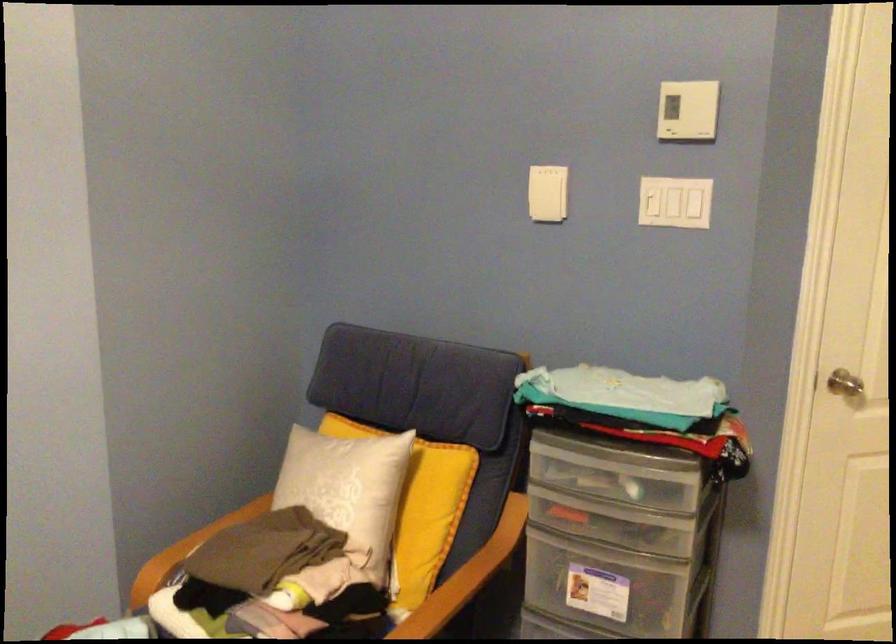
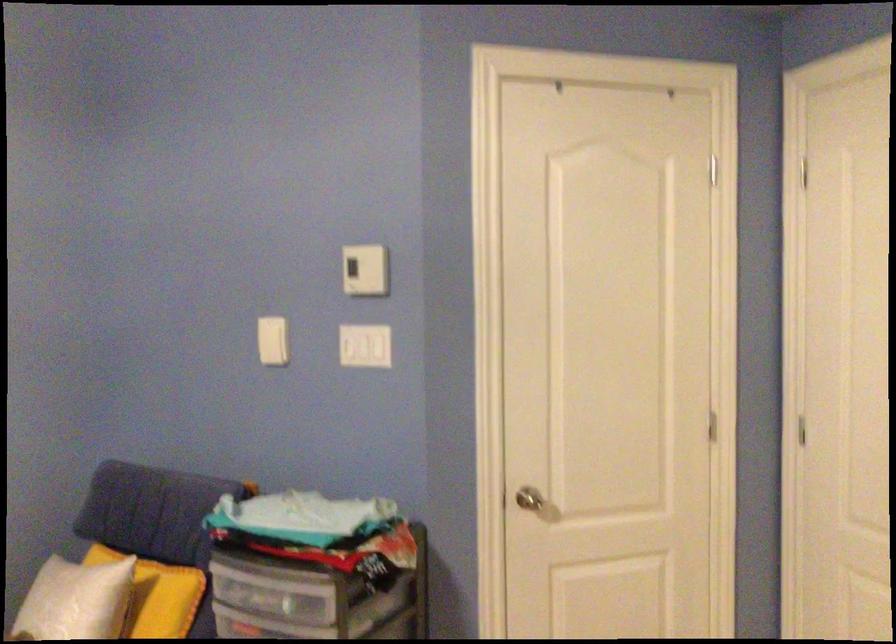
Locate, in the second image, the point that corresponds to (354,471) in the first image.

(74, 601)